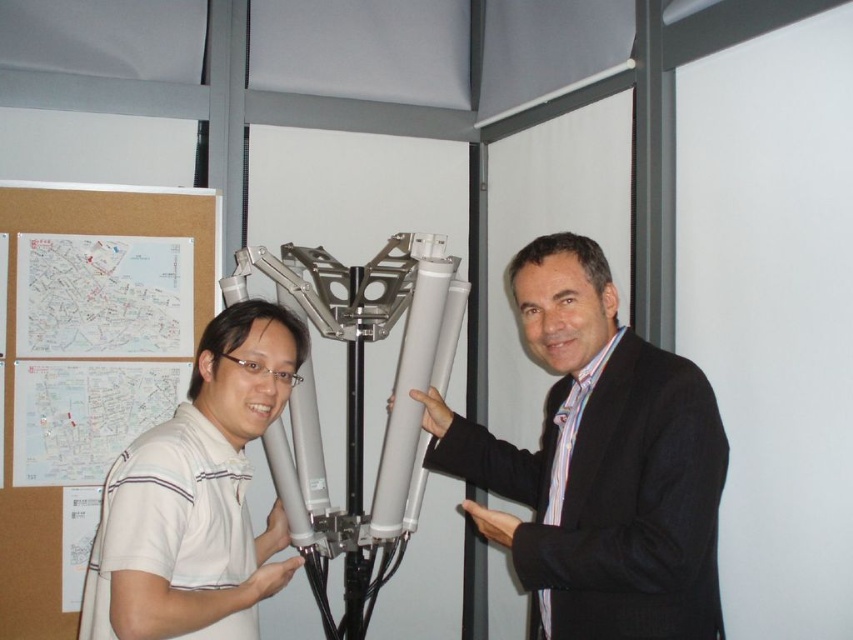
You are a technician assessing the mechanical device. You notice the matte white cylinder at center and the white striped polo shirt at center. Which object is bigger in size?

The matte white cylinder at center has a larger size compared to the white striped polo shirt at center.

What is the object located at the coordinates point (598, 464) in the image?

The object at point (598, 464) is a matte white cylinder at center.

From the picture: You are a technician trying to access the matte white cylinder at center for maintenance. There is a white striped polo shirt at center blocking your path. Can you move around the cylinder to reach its back side?

The white striped polo shirt at center is behind matte white cylinder at center, so you cannot move around the cylinder to reach its back side because the shirt is already positioned behind it, possibly indicating that the shirt is part of the scene and not an obstacle in your path.